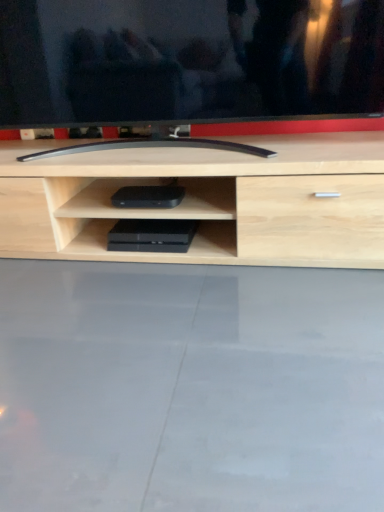
What do you see at coordinates (148, 196) in the screenshot?
I see `black plastic device at center, the 2th equipment when ordered from bottom to top` at bounding box center [148, 196].

This screenshot has width=384, height=512. What do you see at coordinates (187, 62) in the screenshot?
I see `black glossy tv at center` at bounding box center [187, 62].

Describe the element at coordinates (151, 234) in the screenshot. I see `black plastic game console at center, the first equipment when ordered from bottom to top` at that location.

Find the location of a particular element. This screenshot has width=384, height=512. black plastic device at center, the 2th equipment when ordered from bottom to top is located at coordinates (148, 196).

Is black plastic game console at center, the first equipment when ordered from bottom to top, at the right side of black plastic device at center, the 2th equipment when ordered from bottom to top?

In fact, black plastic game console at center, the first equipment when ordered from bottom to top, is to the left of black plastic device at center, the 2th equipment when ordered from bottom to top.

Relative to black plastic device at center, the 2th equipment when ordered from bottom to top, is black plastic game console at center, the first equipment when ordered from bottom to top, in front or behind?

Visually, black plastic game console at center, the first equipment when ordered from bottom to top, is located behind black plastic device at center, the 2th equipment when ordered from bottom to top.

Is black plastic game console at center, the first equipment when ordered from bottom to top, completely or partially outside of black plastic device at center, which is the 1th equipment from top to bottom?

Yes, black plastic game console at center, the first equipment when ordered from bottom to top, is not within black plastic device at center, which is the 1th equipment from top to bottom.

From a real-world perspective, who is located higher, black plastic game console at center, the first equipment when ordered from bottom to top, or black plastic device at center, which is the 1th equipment from top to bottom?

black plastic device at center, which is the 1th equipment from top to bottom, from a real-world perspective.

Based on the photo, is black glossy tv at center further to camera compared to black plastic device at center, which is the 1th equipment from top to bottom?

No, it is in front of black plastic device at center, which is the 1th equipment from top to bottom.

From the image's perspective, is black glossy tv at center beneath black plastic device at center, which is the 1th equipment from top to bottom?

Actually, black glossy tv at center appears above black plastic device at center, which is the 1th equipment from top to bottom, in the image.

Between black glossy tv at center and black plastic device at center, the 2th equipment when ordered from bottom to top, which one has less height?

black plastic device at center, the 2th equipment when ordered from bottom to top.

From a real-world perspective, does black glossy tv at center sit lower than black plastic device at center, which is the 1th equipment from top to bottom?

No.

Between black plastic device at center, the 2th equipment when ordered from bottom to top, and black glossy tv at center, which one has smaller size?

With smaller size is black plastic device at center, the 2th equipment when ordered from bottom to top.

Does point (167, 197) come closer to viewer compared to point (294, 6)?

No.

From the picture: Considering the sizes of objects black plastic device at center, which is the 1th equipment from top to bottom, and black glossy tv at center in the image provided, who is taller, black plastic device at center, which is the 1th equipment from top to bottom, or black glossy tv at center?

Standing taller between the two is black glossy tv at center.

Image resolution: width=384 pixels, height=512 pixels. In order to click on television to the right of black plastic device at center, the 2th equipment when ordered from bottom to top in this screenshot , I will do `click(187, 62)`.

Which of these two, black glossy tv at center or black plastic game console at center, the first equipment when ordered from bottom to top, stands taller?

With more height is black glossy tv at center.

How different are the orientations of black glossy tv at center and black plastic game console at center, positioned as the second equipment in top-to-bottom order, in degrees?

The angle between the facing direction of black glossy tv at center and the facing direction of black plastic game console at center, positioned as the second equipment in top-to-bottom order, is 0.783 degrees.

Is black glossy tv at center behind black plastic game console at center, the first equipment when ordered from bottom to top?

No, black glossy tv at center is closer to the viewer.

From a real-world perspective, which object stands above the other?

From a 3D spatial view, black glossy tv at center is above.

From the image's perspective, is black plastic game console at center, positioned as the second equipment in top-to-bottom order, on top of black glossy tv at center?

No.

Can you confirm if black plastic game console at center, the first equipment when ordered from bottom to top, is positioned to the left of black glossy tv at center?

Correct, you'll find black plastic game console at center, the first equipment when ordered from bottom to top, to the left of black glossy tv at center.

Does point (156, 250) come closer to viewer compared to point (221, 116)?

That is False.

Would you say black plastic device at center, the 2th equipment when ordered from bottom to top, contains black plastic game console at center, the first equipment when ordered from bottom to top?

Actually, black plastic game console at center, the first equipment when ordered from bottom to top, is outside black plastic device at center, the 2th equipment when ordered from bottom to top.

Looking at this image, in terms of height, does black plastic device at center, which is the 1th equipment from top to bottom, look taller or shorter compared to black plastic game console at center, positioned as the second equipment in top-to-bottom order?

Clearly, black plastic device at center, which is the 1th equipment from top to bottom, is taller compared to black plastic game console at center, positioned as the second equipment in top-to-bottom order.

Measure the distance from black plastic device at center, which is the 1th equipment from top to bottom, to black plastic game console at center, positioned as the second equipment in top-to-bottom order.

The distance of black plastic device at center, which is the 1th equipment from top to bottom, from black plastic game console at center, positioned as the second equipment in top-to-bottom order, is 10.26 centimeters.

Considering the relative sizes of black plastic device at center, which is the 1th equipment from top to bottom, and black plastic game console at center, positioned as the second equipment in top-to-bottom order, in the image provided, is black plastic device at center, which is the 1th equipment from top to bottom, bigger than black plastic game console at center, positioned as the second equipment in top-to-bottom order,?

Correct, black plastic device at center, which is the 1th equipment from top to bottom, is larger in size than black plastic game console at center, positioned as the second equipment in top-to-bottom order.

Identify the location of equipment located on the right of black plastic game console at center, positioned as the second equipment in top-to-bottom order. Image resolution: width=384 pixels, height=512 pixels. (148, 196).

The image size is (384, 512). What are the coordinates of `television above the black plastic device at center, the 2th equipment when ordered from bottom to top (from a real-world perspective)` in the screenshot? It's located at pos(187,62).

From the image, which object appears to be farther from black plastic device at center, which is the 1th equipment from top to bottom, black glossy tv at center or black plastic game console at center, positioned as the second equipment in top-to-bottom order?

The object further to black plastic device at center, which is the 1th equipment from top to bottom, is black glossy tv at center.

In the scene shown: From the image, which object appears to be nearer to black plastic game console at center, the first equipment when ordered from bottom to top, black plastic device at center, the 2th equipment when ordered from bottom to top, or black glossy tv at center?

The object closer to black plastic game console at center, the first equipment when ordered from bottom to top, is black plastic device at center, the 2th equipment when ordered from bottom to top.

Which object lies further to the anchor point black glossy tv at center, black plastic device at center, which is the 1th equipment from top to bottom, or black plastic game console at center, positioned as the second equipment in top-to-bottom order?

The object further to black glossy tv at center is black plastic game console at center, positioned as the second equipment in top-to-bottom order.

Which object lies further to the anchor point black plastic device at center, the 2th equipment when ordered from bottom to top, black plastic game console at center, the first equipment when ordered from bottom to top, or black glossy tv at center?

The object further to black plastic device at center, the 2th equipment when ordered from bottom to top, is black glossy tv at center.

Considering their positions, is black plastic game console at center, the first equipment when ordered from bottom to top, positioned closer to black glossy tv at center than black plastic device at center, which is the 1th equipment from top to bottom?

The object closer to black glossy tv at center is black plastic device at center, which is the 1th equipment from top to bottom.

From the image, which object appears to be nearer to black plastic game console at center, the first equipment when ordered from bottom to top, black glossy tv at center or black plastic device at center, the 2th equipment when ordered from bottom to top?

black plastic device at center, the 2th equipment when ordered from bottom to top, is closer to black plastic game console at center, the first equipment when ordered from bottom to top.

The width and height of the screenshot is (384, 512). Find the location of `equipment that lies between black glossy tv at center and black plastic game console at center, the first equipment when ordered from bottom to top, from top to bottom`. equipment that lies between black glossy tv at center and black plastic game console at center, the first equipment when ordered from bottom to top, from top to bottom is located at coordinates (148, 196).